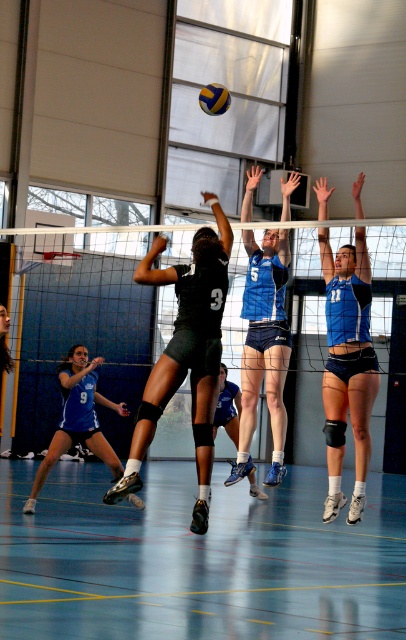
Based on the scene description, where is the smooth wooden floor at center located in terms of coordinates?

The smooth wooden floor at center is located at coordinates point (198,560).

In the volleyball game scene, there are two players wearing blue uniforms at the center of the image. One is labeled as the blue uniform at center, and the other is the blue jersey at center. Which of these two has a wider width?

The blue uniform at center has a wider width than the blue jersey at center according to the description.